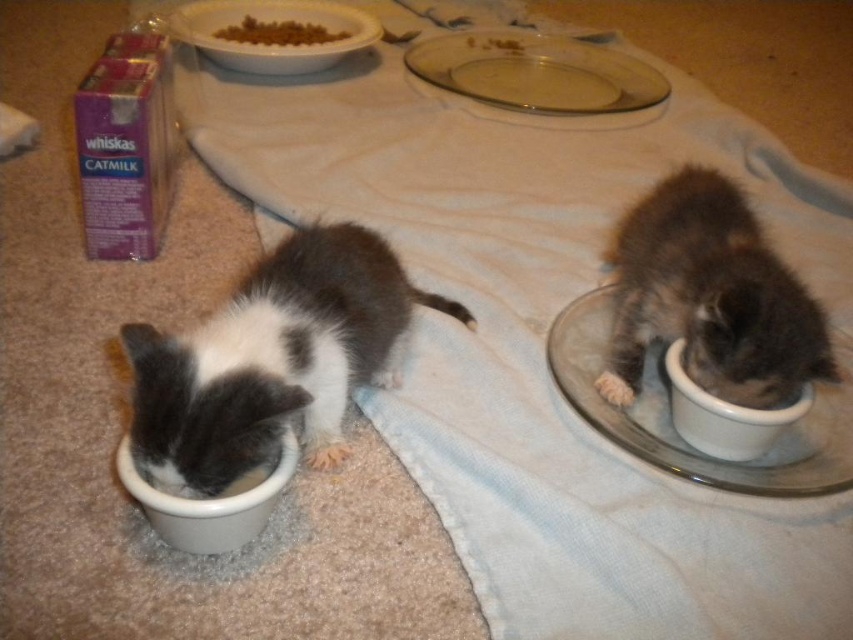
Consider the image. You are a cat owner who wants to place a new toy between the two points, point (596, 422) and point (262, 61). Which point should the toy be closer to so that it is in front of both points?

The toy should be placed closer to point (596, 422) because it is in front of point (262, 61).

You are a cat owner who wants to place a new toy exactly at the midpoint between the two bowls. The white glossy bowl at right is located at point 0.650, 0.850. Where should you place the toy?

The midpoint between the two bowls would be at the average of their coordinates. Since the white glossy bowl at right is at (724, 416), and the other bowl is at the left position, but its coordinates aren